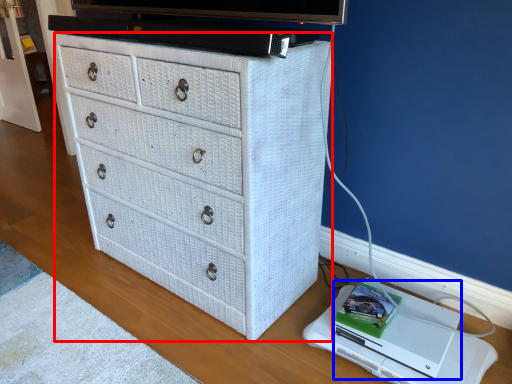
Question: Which object is further to the camera taking this photo, chest of drawers (highlighted by a red box) or computer (highlighted by a blue box)?

Choices:
 (A) chest of drawers
 (B) computer

Answer: (B)